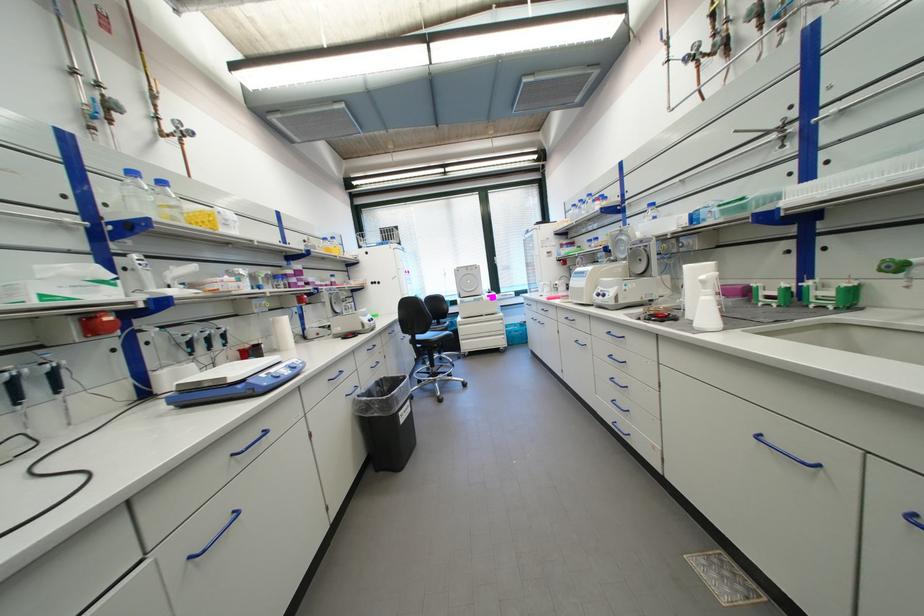
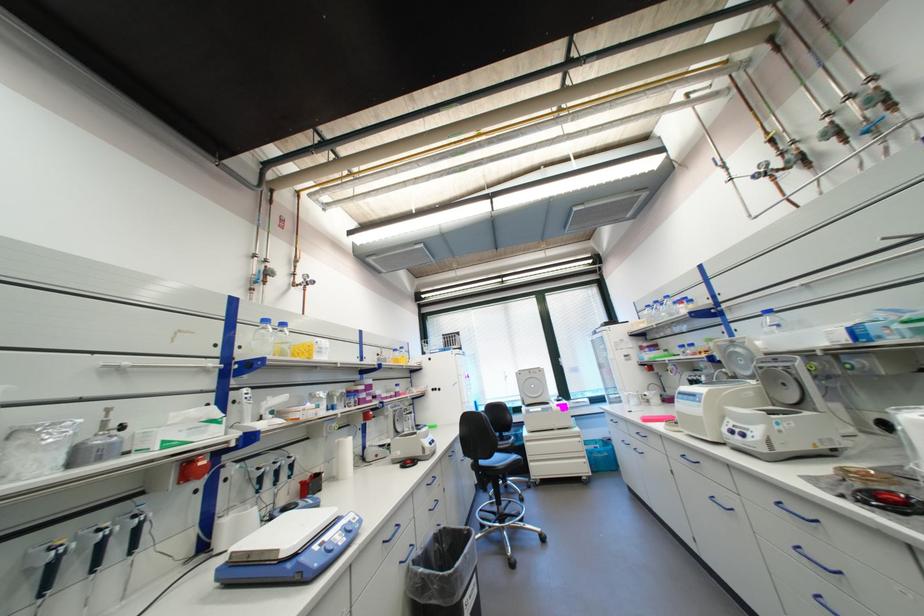
In the second image, find the point that corresponds to pixel 132 270 in the first image.

(242, 403)